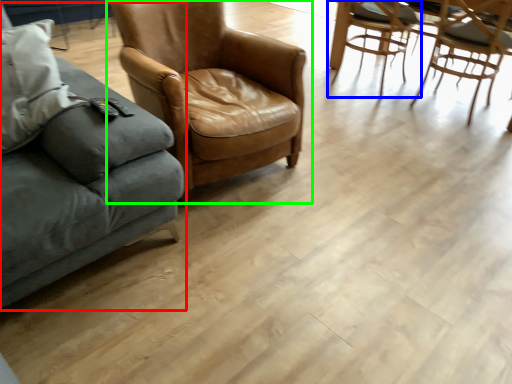
Question: Which object is positioned closest to studio couch (highlighted by a red box)? Select from chair (highlighted by a blue box) and chair (highlighted by a green box).

Choices:
 (A) chair
 (B) chair

Answer: (B)